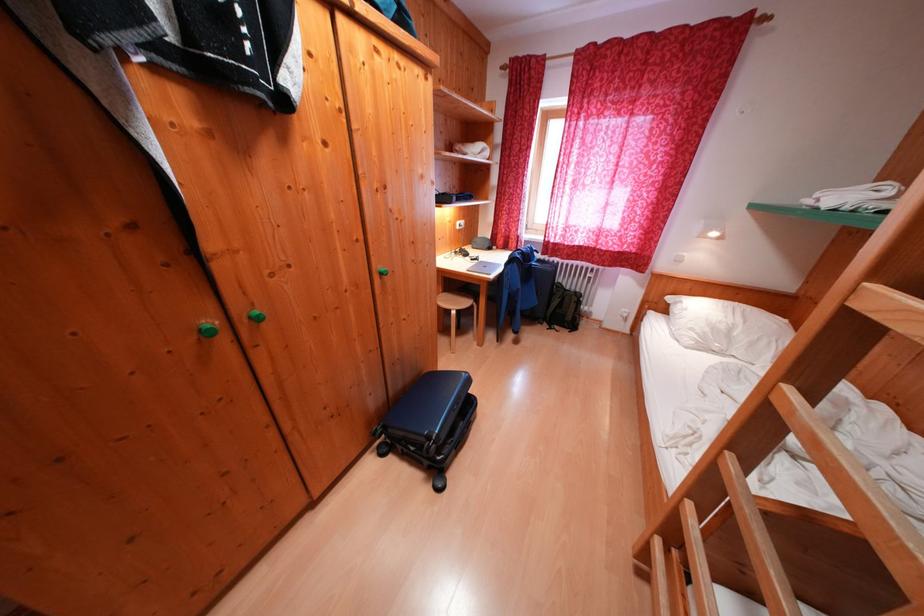
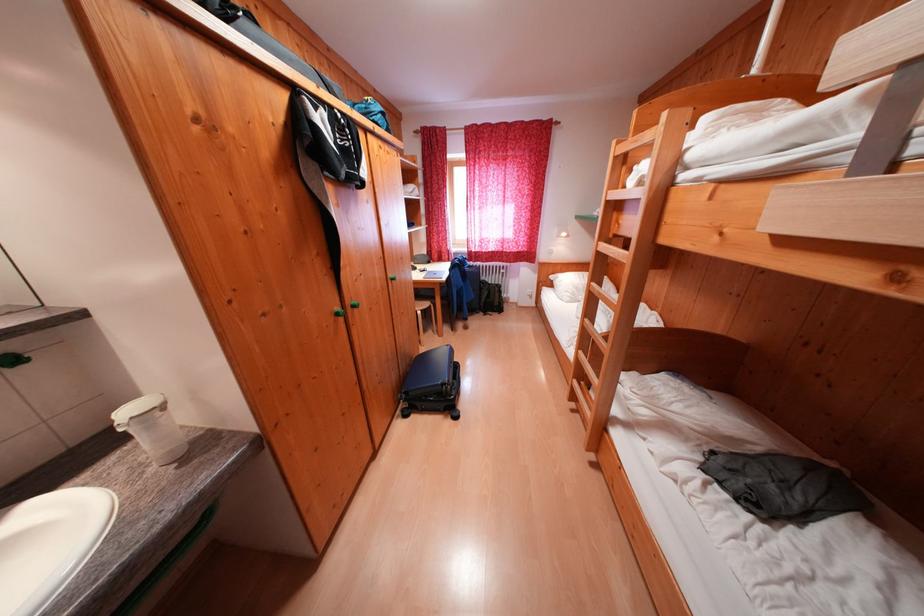
The point at (516,269) is marked in the first image. Where is the corresponding point in the second image?

(458, 274)